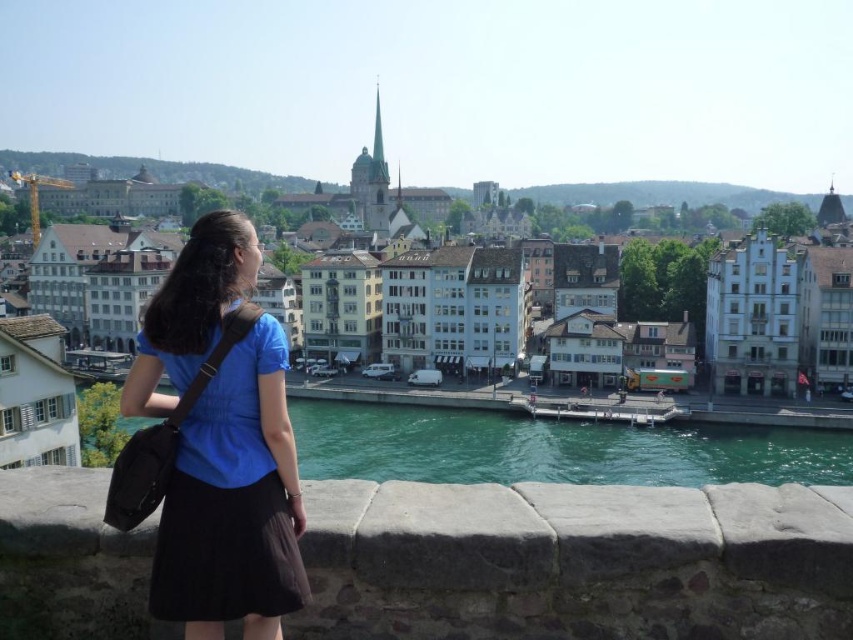
Is blue fabric shirt at center below teal glossy water at center?

No.

Locate an element on the screen. Image resolution: width=853 pixels, height=640 pixels. blue fabric shirt at center is located at coordinates (213, 444).

Find the location of a particular element. The width and height of the screenshot is (853, 640). blue fabric shirt at center is located at coordinates (213, 444).

Is teal glossy water at center above white stone buildings at center?

No, teal glossy water at center is not above white stone buildings at center.

Which is behind, point (619, 449) or point (96, 200)?

The point (96, 200) is behind.

At what (x,y) coordinates should I click in order to perform the action: click on teal glossy water at center. Please return your answer as a coordinate pair (x, y). Looking at the image, I should click on (553, 449).

Describe the element at coordinates (213, 444) in the screenshot. I see `blue fabric shirt at center` at that location.

Who is lower down, blue fabric shirt at center or white stone buildings at center?

blue fabric shirt at center

You are a GUI agent. You are given a task and a screenshot of the screen. Output one action in this format:
    pyautogui.click(x=<x>, y=<y>)
    Task: Click on the blue fabric shirt at center
    
    Given the screenshot: What is the action you would take?
    pyautogui.click(x=213, y=444)

Identify the location of blue fabric shirt at center. The height and width of the screenshot is (640, 853). (213, 444).